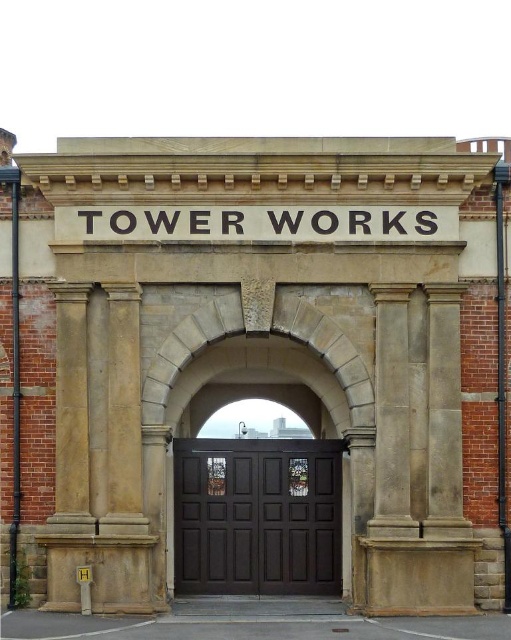
Does point (321, 525) come behind point (208, 205)?

Yes, point (321, 525) is farther from viewer.

Which is behind, point (236, 516) or point (274, 205)?

Point (236, 516)

What are the coordinates of `dark wood door at center` in the screenshot? It's located at 258,516.